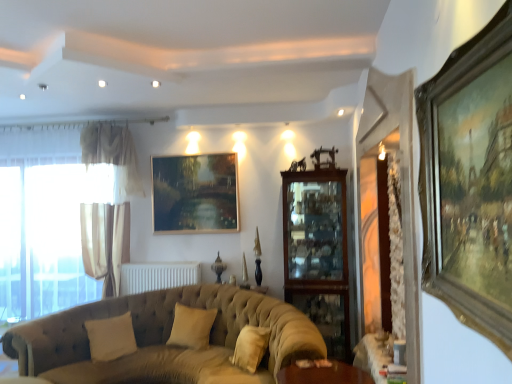
Question: Considering the relative sizes of beige fabric pillow at center, the 2th pillow from the left, and beige fabric pillow at lower left, which appears as the 1th pillow when viewed from the left, in the image provided, is beige fabric pillow at center, the 2th pillow from the left, wider than beige fabric pillow at lower left, which appears as the 1th pillow when viewed from the left,?

Choices:
 (A) yes
 (B) no

Answer: (A)

Question: Is beige fabric pillow at center, which appears as the first pillow when viewed from the right, to the right of beige fabric pillow at lower left, which appears as the 1th pillow when viewed from the left, from the viewer's perspective?

Choices:
 (A) no
 (B) yes

Answer: (B)

Question: Is beige fabric pillow at center, the 2th pillow from the left, aimed at beige fabric pillow at lower left, the 2th pillow positioned from the right?

Choices:
 (A) no
 (B) yes

Answer: (A)

Question: From the image's perspective, is beige fabric pillow at center, which appears as the first pillow when viewed from the right, on beige fabric pillow at lower left, the 2th pillow positioned from the right?

Choices:
 (A) no
 (B) yes

Answer: (B)

Question: From a real-world perspective, is beige fabric pillow at center, the 2th pillow from the left, located higher than beige fabric pillow at lower left, which appears as the 1th pillow when viewed from the left?

Choices:
 (A) no
 (B) yes

Answer: (B)

Question: Is beige fabric pillow at center, the 2th pillow from the left, bigger or smaller than white sheer curtains at left?

Choices:
 (A) small
 (B) big

Answer: (A)

Question: From a real-world perspective, is beige fabric pillow at center, which appears as the first pillow when viewed from the right, above or below white sheer curtains at left?

Choices:
 (A) below
 (B) above

Answer: (A)

Question: Is beige fabric pillow at center, the 2th pillow from the left, in front of or behind white sheer curtains at left in the image?

Choices:
 (A) behind
 (B) front

Answer: (B)

Question: In terms of width, does beige fabric pillow at center, which appears as the first pillow when viewed from the right, look wider or thinner when compared to white sheer curtains at left?

Choices:
 (A) wide
 (B) thin

Answer: (A)

Question: Considering the positions of gold-toned wooden picture frame at right, which ranks as the 2th picture frame in back-to-front order, and wooden table at lower right in the image, is gold-toned wooden picture frame at right, which ranks as the 2th picture frame in back-to-front order, wider or thinner than wooden table at lower right?

Choices:
 (A) wide
 (B) thin

Answer: (B)

Question: Based on their positions, is gold-toned wooden picture frame at right, which appears as the 1th picture frame when viewed from the front, located to the left or right of wooden table at lower right?

Choices:
 (A) left
 (B) right

Answer: (A)

Question: From their relative heights in the image, would you say gold-toned wooden picture frame at right, acting as the 1th picture frame starting from the right, is taller or shorter than wooden table at lower right?

Choices:
 (A) tall
 (B) short

Answer: (A)

Question: Is gold-toned wooden picture frame at right, which ranks as the 2th picture frame in back-to-front order, inside or outside of wooden table at lower right?

Choices:
 (A) outside
 (B) inside

Answer: (A)

Question: Considering their positions, is white sheer curtains at left located in front of or behind tufted fabric couch at lower left?

Choices:
 (A) behind
 (B) front

Answer: (A)

Question: Considering the positions of point (77, 175) and point (315, 347), is point (77, 175) closer or farther from the camera than point (315, 347)?

Choices:
 (A) farther
 (B) closer

Answer: (A)